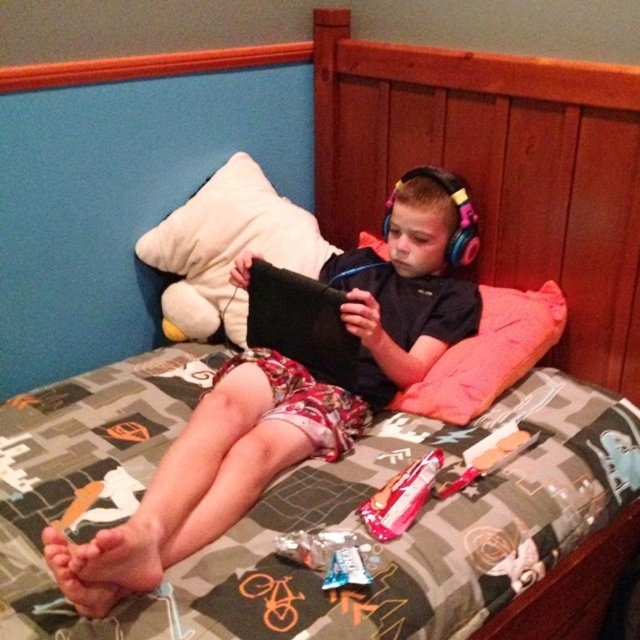
Looking at this image, you are a parent trying to locate your child who is lying on the bed. You see a point marked at coordinates [227,248]. What object is located at that point?

The point at coordinates [227,248] marks the location of the white plush at upper left.

You are a delivery person who needs to place a small package on the bed. The wooden at upper center and the black matte tablet at center are already on the bed. Which object should you avoid placing the package near if you want to ensure the package doesn t block the tablet?

You should avoid placing the package near the black matte tablet at center because the wooden at upper center has a lesser width, so the tablet is wider and might be in a more central or obstructive position.

You are a parent looking at your child in the room. You see the wooden at upper center and the pink fabric pillow at upper right. Which object is larger in size?

The wooden at upper center is bigger than the pink fabric pillow at upper right.